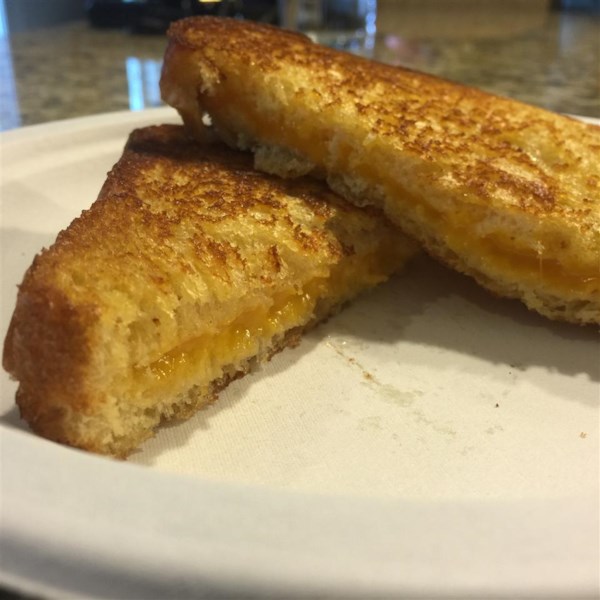
I want to click on something to eat off of, so click(346, 458).